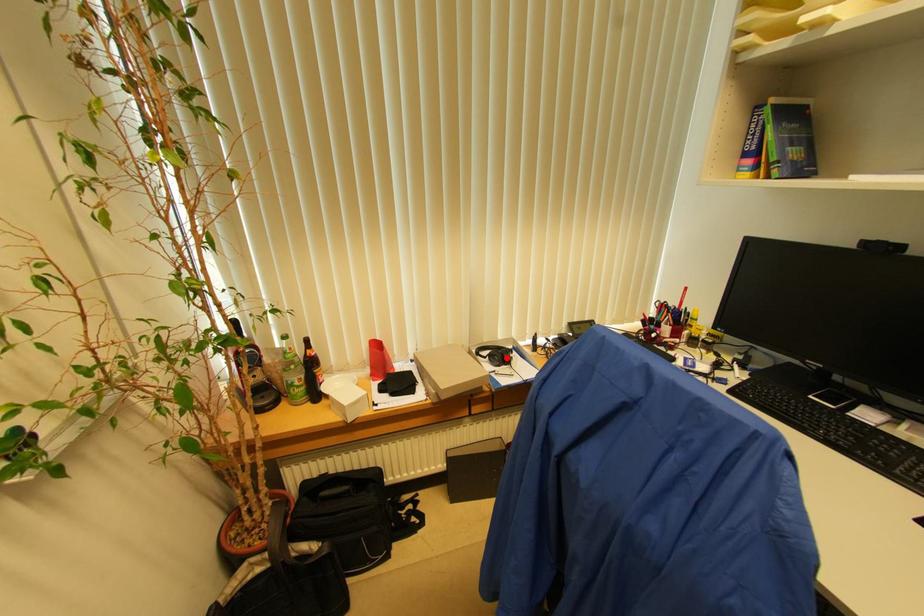
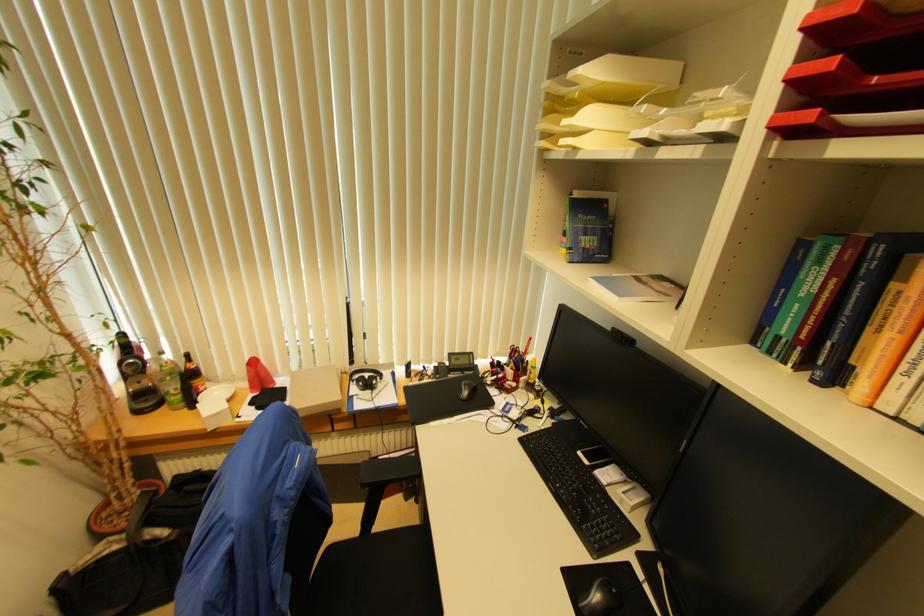
Question: A red point is marked in image1. In image2, is the corresponding 3D point closer to the camera or farther? Reply with the corresponding letter.

Choices:
 (A) The corresponding 3D point is closer.
 (B) The corresponding 3D point is farther.

Answer: (A)